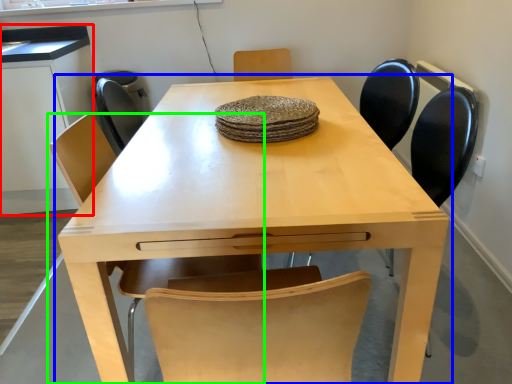
Question: Which is nearer to the computer desk (highlighted by a red box)? table (highlighted by a blue box) or chair (highlighted by a green box).

Choices:
 (A) table
 (B) chair

Answer: (A)